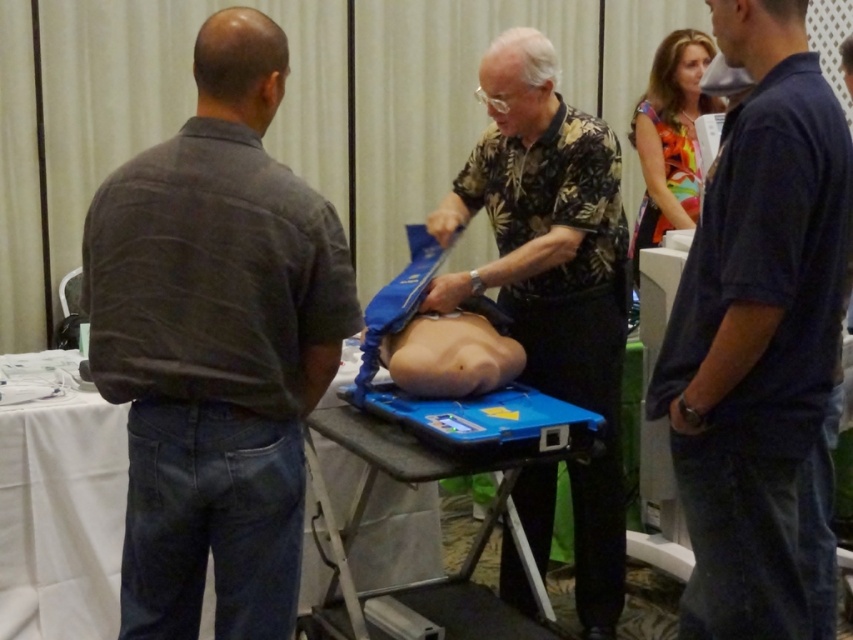
Describe the element at coordinates (761, 340) in the screenshot. The height and width of the screenshot is (640, 853). I see `dark blue shirt at right` at that location.

Who is more forward, (761, 467) or (495, 340)?

Point (761, 467)

Is point (788, 3) closer to camera compared to point (421, 385)?

That is True.

The width and height of the screenshot is (853, 640). I want to click on dark blue shirt at right, so click(x=761, y=340).

Between point (346, 305) and point (318, 579), which one is positioned in front?

Point (346, 305)

Is dark gray shirt at left thinner than blue plastic table at center?

In fact, dark gray shirt at left might be wider than blue plastic table at center.

Where is `dark gray shirt at left`? dark gray shirt at left is located at coordinates (215, 344).

Is point (616, 253) more distant than point (495, 380)?

That is True.

Can you confirm if floral shirt at center is positioned above smooth skin at center?

Correct, floral shirt at center is located above smooth skin at center.

Identify the location of floral shirt at center. This screenshot has height=640, width=853. (553, 276).